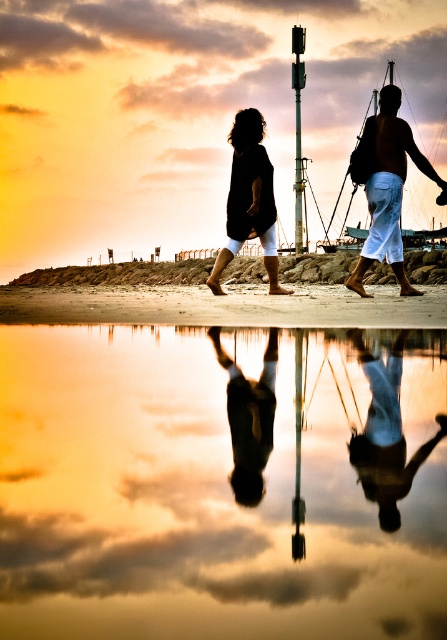
You are a photographer trying to capture the sunset at the beach. You notice the sandy beach at lower center and the smooth skin figure at center. Which object is wider in the image?

The sandy beach at lower center is wider than the smooth skin figure at center.

You are standing on the beach looking at the sunset. There are two points marked in the image. One is at coordinates point (15, 294) and the other is at point (380, 166). Which point is closer to you?

Point (15, 294) is closer to you because it is further to the viewer than point (380, 166).